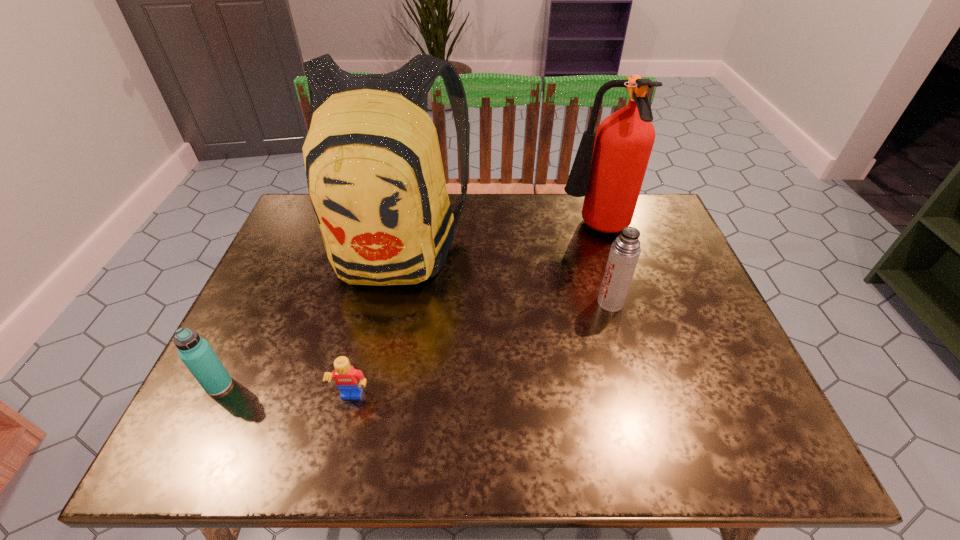
Locate an element on the screen. backpack is located at coordinates (375, 177).

At what (x,y) coordinates should I click in order to perform the action: click on fire extinguisher. Please return your answer as a coordinate pair (x, y). Looking at the image, I should click on (609, 173).

Where is `the right thermos bottle`? The image size is (960, 540). the right thermos bottle is located at coordinates (625, 250).

The height and width of the screenshot is (540, 960). What are the coordinates of `the third shortest object` in the screenshot? It's located at (625, 250).

Find the location of `the leftmost object`. the leftmost object is located at coordinates (195, 352).

Locate an element on the screen. Image resolution: width=960 pixels, height=540 pixels. the left thermos bottle is located at coordinates (195, 352).

Locate an element on the screen. Lego is located at coordinates (349, 381).

I want to click on vacant area situated on the front-facing side of the backpack, so click(x=354, y=437).

At what (x,y) coordinates should I click in order to perform the action: click on vacant point located 0.170m at the nozzle of the fire extinguisher. Please return your answer as a coordinate pair (x, y). Looking at the image, I should click on (502, 230).

The image size is (960, 540). I want to click on vacant space located 0.270m at the nozzle of the fire extinguisher, so click(468, 230).